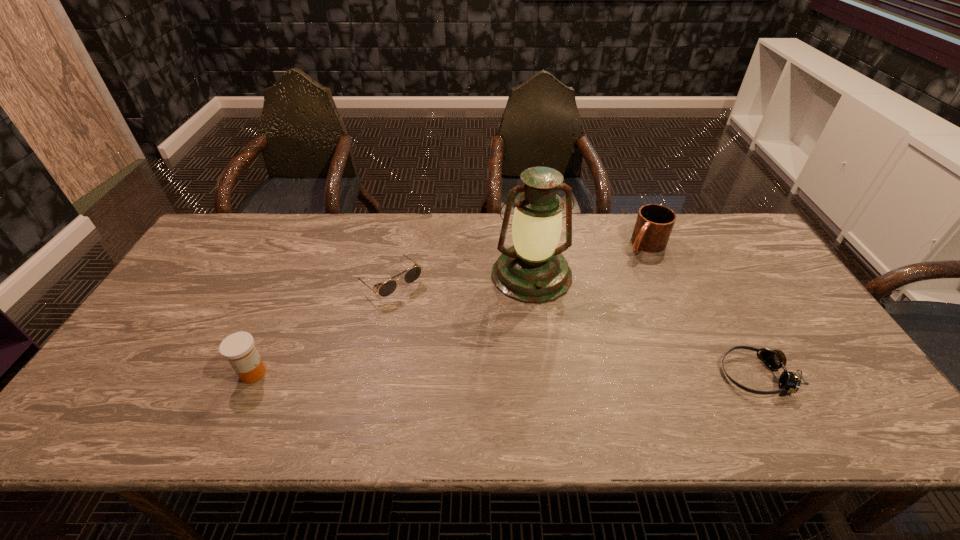
This screenshot has height=540, width=960. What are the coordinates of `the leftmost object` in the screenshot? It's located at (238, 348).

Identify the location of goggles. This screenshot has width=960, height=540. (789, 381).

The width and height of the screenshot is (960, 540). Find the location of `the fourth object from right to left`. the fourth object from right to left is located at coordinates (387, 288).

The width and height of the screenshot is (960, 540). Identify the location of the second shortest object. (387, 288).

The image size is (960, 540). Identify the location of the third object from right to left. (533, 270).

Locate an element on the screen. This screenshot has height=540, width=960. the tallest object is located at coordinates (533, 270).

Identify the location of mug. The width and height of the screenshot is (960, 540). (654, 224).

Locate an element on the screen. blank space located 0.110m on the label of the medicine is located at coordinates (193, 373).

The image size is (960, 540). Identify the location of blank space located on the label of the medicine. (156, 373).

Locate an element on the screen. vacant space located on the label of the medicine is located at coordinates (201, 373).